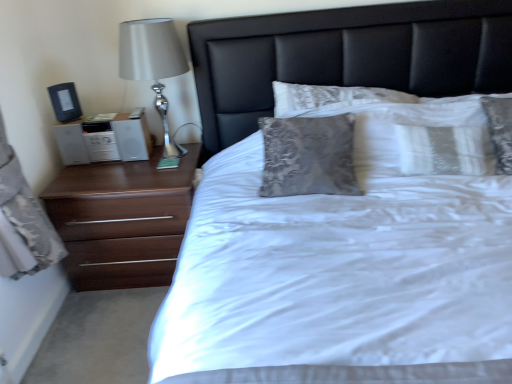
Identify the location of vacant space situated above brown wood chest of drawers at left (from a real-world perspective). This screenshot has width=512, height=384. (116, 176).